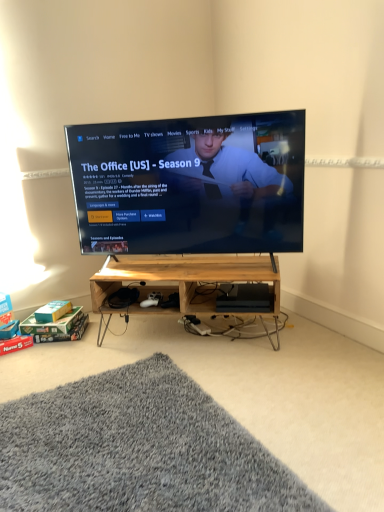
This screenshot has height=512, width=384. In order to click on free area in between wooden at center, the 1th shelf when ordered from bottom to top, and gray shaggy rug at lower left in this screenshot , I will do `click(223, 386)`.